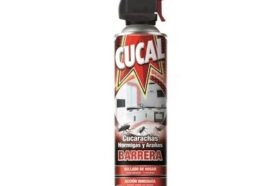
This screenshot has height=186, width=280. I want to click on wall, so click(149, 95).